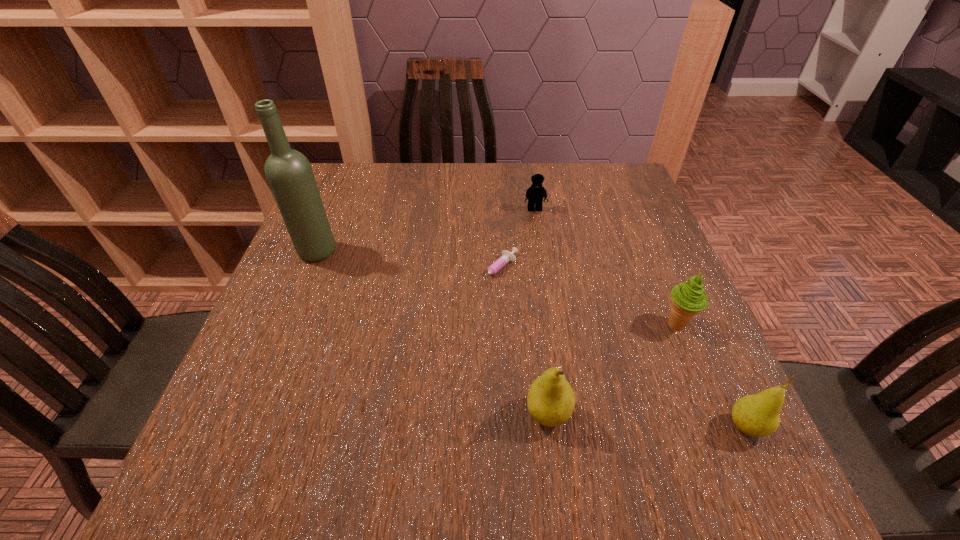
Find the location of a particular element. Image resolution: width=960 pixels, height=540 pixels. free spot between the right pear and the wine bottle is located at coordinates [x=531, y=340].

The width and height of the screenshot is (960, 540). In order to click on vacant area that lies between the taller pear and the icecream in this screenshot , I will do `click(612, 369)`.

This screenshot has height=540, width=960. What are the coordinates of `vacant area between the syringe and the left pear` in the screenshot? It's located at (522, 343).

This screenshot has width=960, height=540. Identify the location of free space between the syringe and the farthest object. (516, 240).

You are a GUI agent. You are given a task and a screenshot of the screen. Output one action in this format:
    pyautogui.click(x=<x>, y=<y>)
    Task: Click on the blank region between the farthest object and the icecream
    
    Given the screenshot: What is the action you would take?
    pyautogui.click(x=606, y=267)

In order to click on the third closest object to the right pear in this screenshot , I will do `click(507, 256)`.

Where is `object that is the third nearest to the syringe`? object that is the third nearest to the syringe is located at coordinates (688, 298).

Image resolution: width=960 pixels, height=540 pixels. I want to click on vacant region that satisfies the following two spatial constraints: 1. on the front side of the left pear; 2. on the right side of the shorter pear, so click(x=549, y=427).

Locate an element on the screen. Image resolution: width=960 pixels, height=540 pixels. free spot that satisfies the following two spatial constraints: 1. on the front side of the icecream; 2. on the left side of the wine bottle is located at coordinates (287, 324).

The height and width of the screenshot is (540, 960). What are the coordinates of `free space that satisfies the following two spatial constraints: 1. on the front side of the right pear; 2. on the left side of the icecream` in the screenshot? It's located at (720, 427).